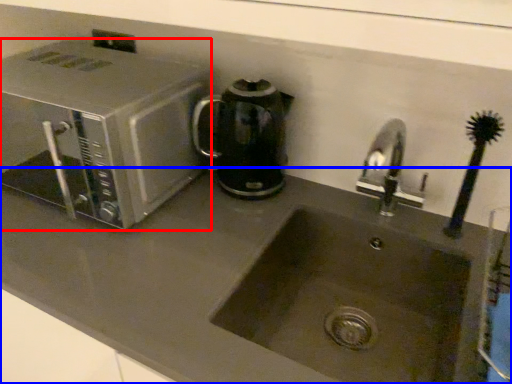
Question: Which object appears farthest to the camera in this image, microwave oven (highlighted by a red box) or counter top (highlighted by a blue box)?

Choices:
 (A) microwave oven
 (B) counter top

Answer: (A)